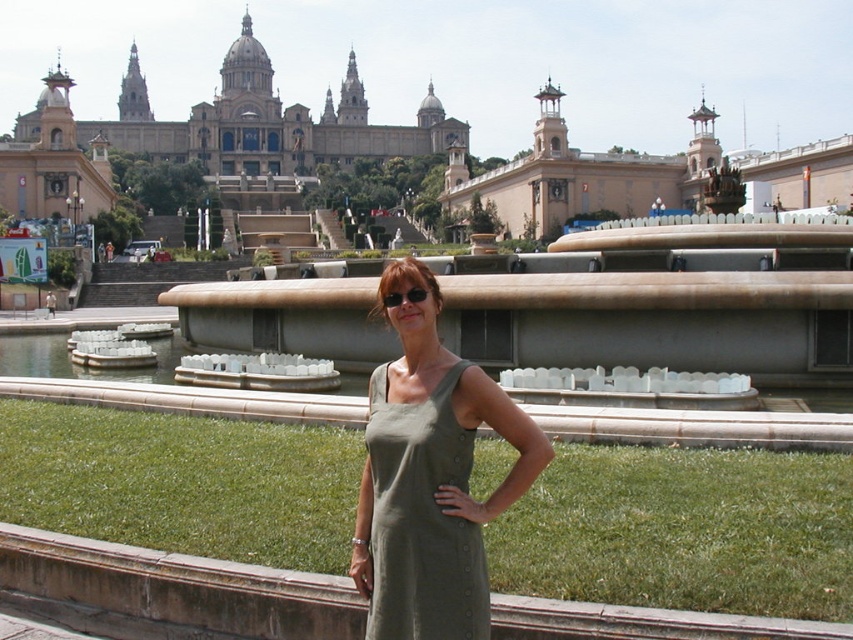
Question: Which point appears closest to the camera in this image?

Choices:
 (A) (393, 307)
 (B) (321, 515)
 (C) (399, 262)

Answer: (A)

Question: Which of these objects is positioned farthest from the sunglasses at center?

Choices:
 (A) green grass at center
 (B) smooth beige wall at center
 (C) green linen dress at center
 (D) beige stone palace at upper center

Answer: (D)

Question: Which object appears closest to the camera in this image?

Choices:
 (A) olive green fabric dress at center
 (B) green linen dress at center

Answer: (A)

Question: Where is beige stone palace at upper center located in relation to sunglasses at center in the image?

Choices:
 (A) right
 (B) left

Answer: (B)

Question: Does olive green fabric dress at center appear under green linen dress at center?

Choices:
 (A) yes
 (B) no

Answer: (B)

Question: Is green linen dress at center to the right of beige stone palace at upper center from the viewer's perspective?

Choices:
 (A) no
 (B) yes

Answer: (B)